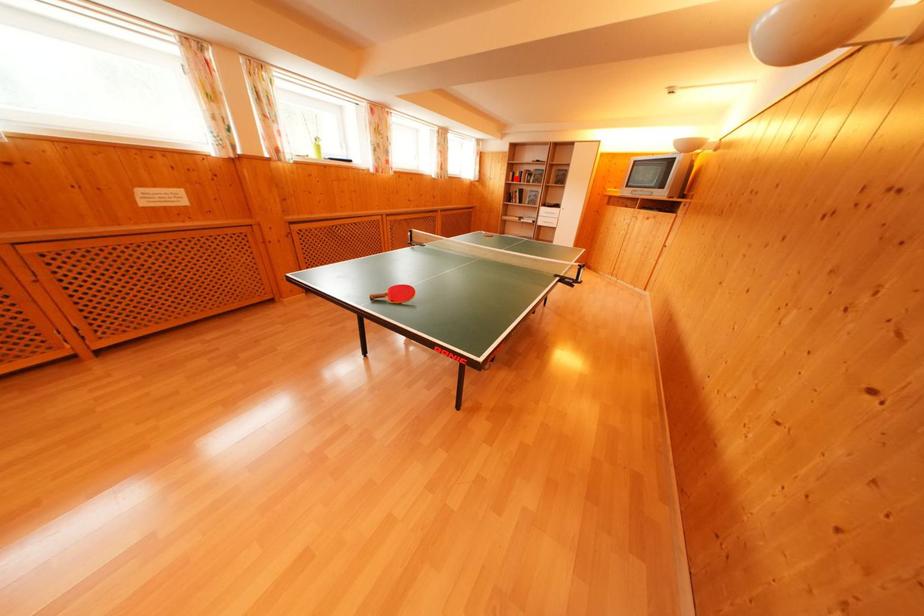
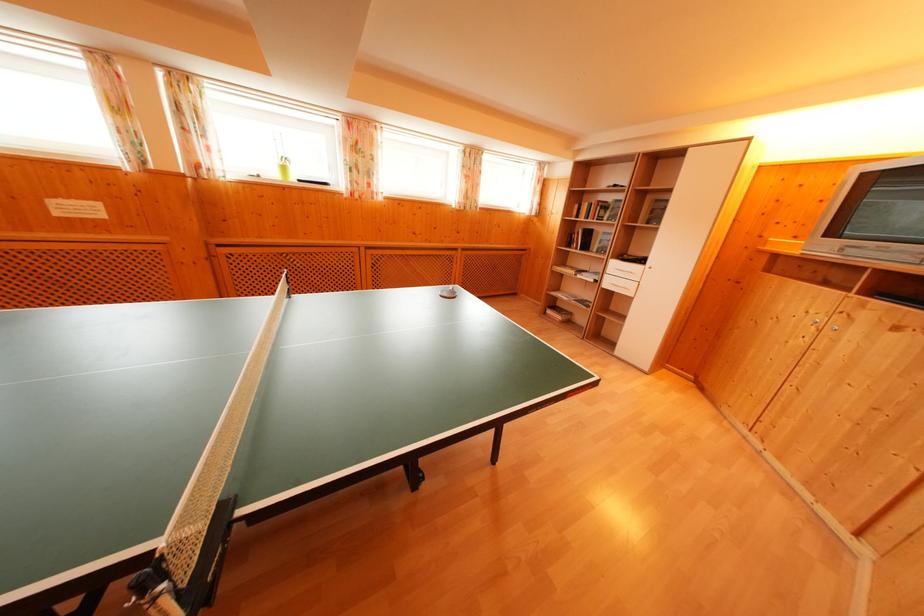
Question: I am providing you with two images of the same scene from different viewpoints. In image1, a red point is highlighted. Considering the same 3D point in image2, which of the following is correct?

Choices:
 (A) It is closer
 (B) It is farther

Answer: (B)